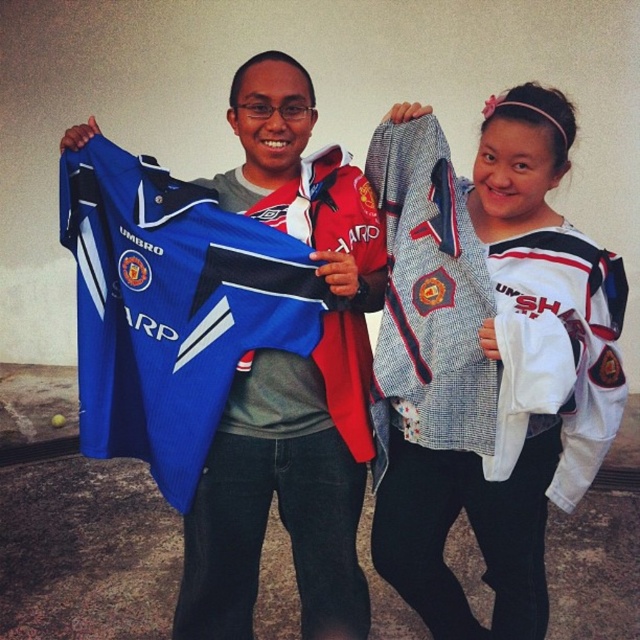
Is white textured jacket at upper right positioned before blue mesh jersey at center?

Yes, it is in front of blue mesh jersey at center.

The height and width of the screenshot is (640, 640). What do you see at coordinates (513, 387) in the screenshot? I see `white textured jacket at upper right` at bounding box center [513, 387].

What are the coordinates of `white textured jacket at upper right` in the screenshot? It's located at point(513,387).